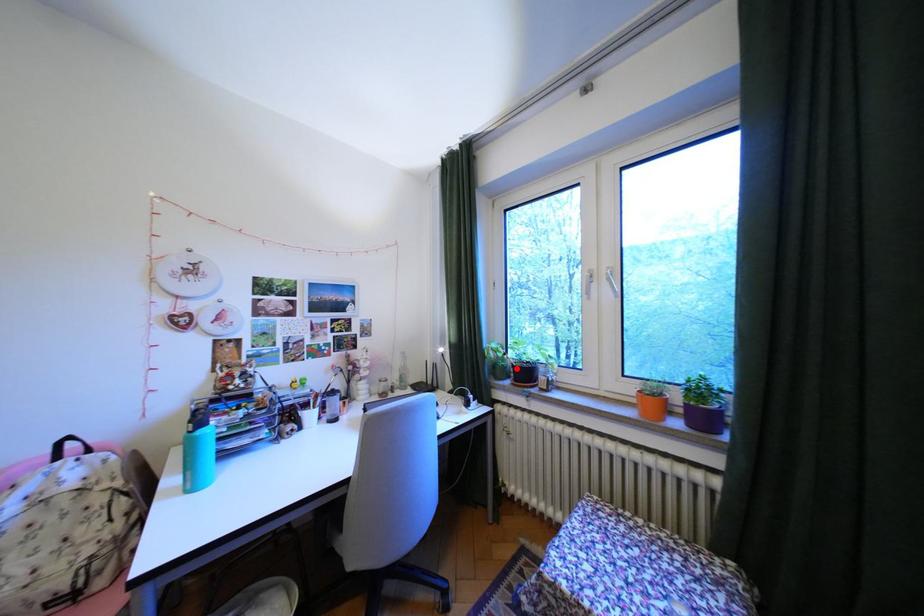
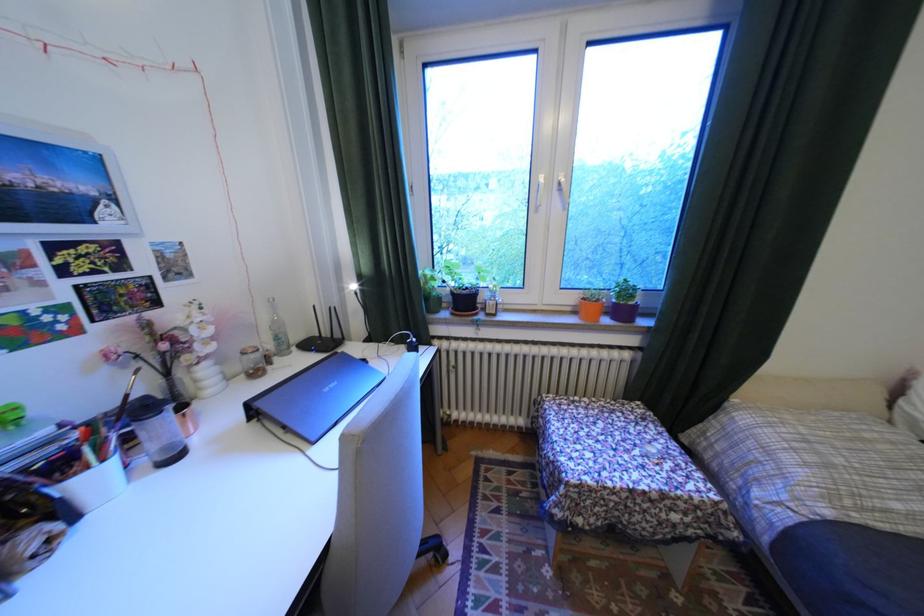
The point at the highlighted location is marked in the first image. Where is the corresponding point in the second image?

(451, 299)